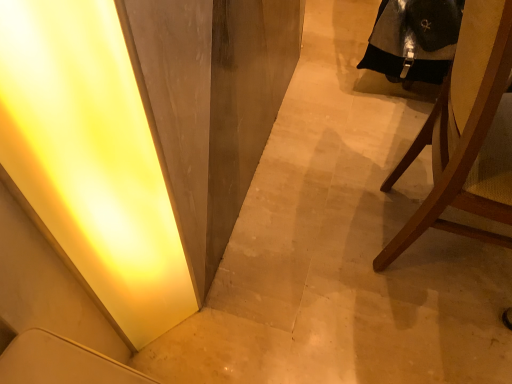
Question: Can you confirm if black leather robe at upper right is taller than brown wooden chair at right?

Choices:
 (A) yes
 (B) no

Answer: (B)

Question: Does black leather robe at upper right lie in front of brown wooden chair at right?

Choices:
 (A) yes
 (B) no

Answer: (B)

Question: Is black leather robe at upper right not close to brown wooden chair at right?

Choices:
 (A) no
 (B) yes

Answer: (A)

Question: Does black leather robe at upper right appear on the right side of brown wooden chair at right?

Choices:
 (A) no
 (B) yes

Answer: (A)

Question: Would you say black leather robe at upper right is outside brown wooden chair at right?

Choices:
 (A) no
 (B) yes

Answer: (A)

Question: Is brown wooden chair at right bigger or smaller than black leather robe at upper right?

Choices:
 (A) small
 (B) big

Answer: (B)

Question: Considering the positions of brown wooden chair at right and black leather robe at upper right in the image, is brown wooden chair at right wider or thinner than black leather robe at upper right?

Choices:
 (A) wide
 (B) thin

Answer: (A)

Question: Relative to black leather robe at upper right, is brown wooden chair at right in front or behind?

Choices:
 (A) behind
 (B) front

Answer: (B)

Question: Is brown wooden chair at right inside or outside of black leather robe at upper right?

Choices:
 (A) inside
 (B) outside

Answer: (B)

Question: From the image's perspective, is black leather robe at upper right positioned above or below matte yellow light at lower left?

Choices:
 (A) above
 (B) below

Answer: (A)

Question: From a real-world perspective, relative to matte yellow light at lower left, is black leather robe at upper right vertically above or below?

Choices:
 (A) below
 (B) above

Answer: (A)

Question: Does point (434, 9) appear closer or farther from the camera than point (116, 304)?

Choices:
 (A) farther
 (B) closer

Answer: (A)

Question: Based on their sizes in the image, would you say black leather robe at upper right is bigger or smaller than matte yellow light at lower left?

Choices:
 (A) small
 (B) big

Answer: (B)

Question: Choose the correct answer: Is brown wooden chair at right inside matte yellow light at lower left or outside it?

Choices:
 (A) outside
 (B) inside

Answer: (A)

Question: Considering the positions of brown wooden chair at right and matte yellow light at lower left in the image, is brown wooden chair at right wider or thinner than matte yellow light at lower left?

Choices:
 (A) thin
 (B) wide

Answer: (B)